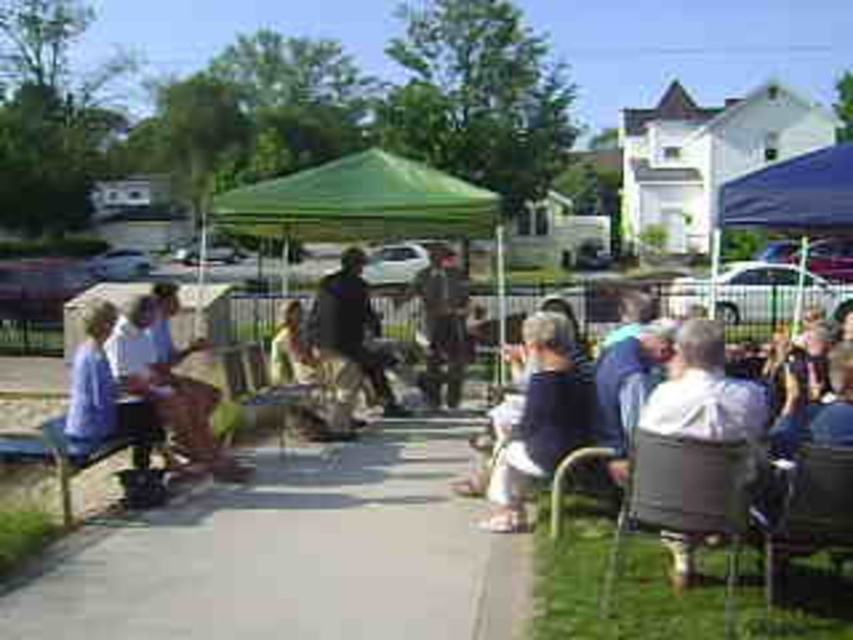
Between point (630, 499) and point (289, 404), which one is positioned behind?

The point (289, 404) is behind.

Who is shorter, metallic silver chair at lower right or wooden chair at center?

With less height is wooden chair at center.

Where is `metallic silver chair at lower right`? This screenshot has width=853, height=640. metallic silver chair at lower right is located at coordinates (685, 497).

Is the position of green fabric canopy at center less distant than that of metallic gray chair at right?

No, it is not.

Between point (277, 211) and point (845, 508), which one is positioned in front?

Positioned in front is point (845, 508).

What are the coordinates of `green fabric canopy at center` in the screenshot? It's located at (358, 202).

Is metallic gray chair at right smaller than blue fabric canopy at upper right?

Correct, metallic gray chair at right occupies less space than blue fabric canopy at upper right.

Who is more forward, (788, 512) or (833, 164)?

Point (788, 512)

The image size is (853, 640). In order to click on metallic gray chair at right in this screenshot , I will do `click(805, 509)`.